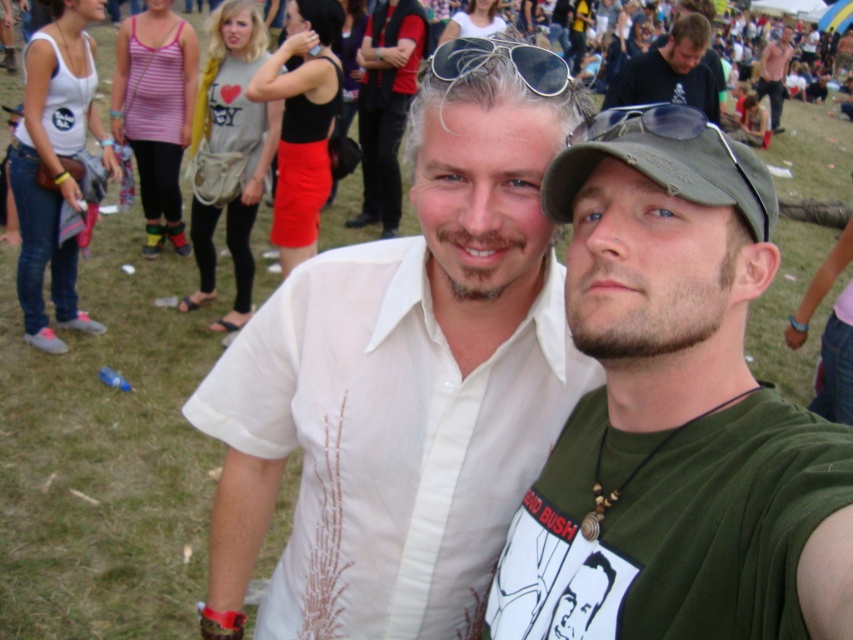
You are at a festival and want to find the person wearing the white cotton shirt at center. Where should you look relative to the sunglasses at center?

The white cotton shirt at center is positioned under the sunglasses at center, so you should look below the sunglasses at center to find the person wearing the white cotton shirt at center.